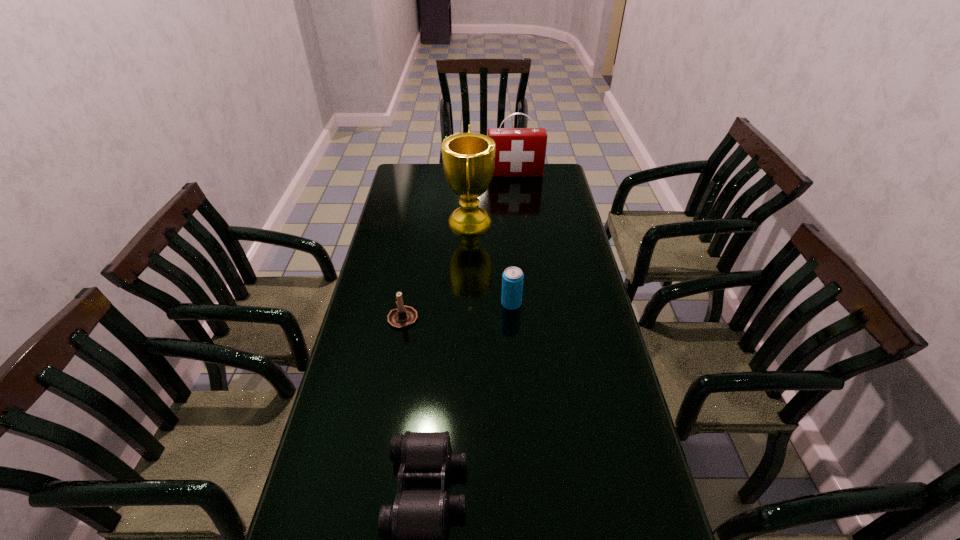
The height and width of the screenshot is (540, 960). What are the coordinates of `object located in the far edge section of the desktop` in the screenshot? It's located at (520, 152).

The width and height of the screenshot is (960, 540). What are the coordinates of `object located at the left edge` in the screenshot? It's located at (403, 316).

Locate an element on the screen. The image size is (960, 540). object that is at the right edge is located at coordinates (520, 152).

Locate an element on the screen. This screenshot has height=540, width=960. object located in the far right corner section of the desktop is located at coordinates (520, 152).

In the image, there is a desktop. Where is `free space at the left edge`? free space at the left edge is located at coordinates (392, 234).

The width and height of the screenshot is (960, 540). Identify the location of free location at the right edge. (555, 234).

Image resolution: width=960 pixels, height=540 pixels. In the image, there is a desktop. In order to click on free space at the far right corner in this screenshot , I will do `click(548, 181)`.

Image resolution: width=960 pixels, height=540 pixels. In order to click on free spot between the candle holder and the soda can in this screenshot , I will do `click(457, 310)`.

Locate an element on the screen. free point between the second shortest object and the farthest object is located at coordinates (459, 246).

The width and height of the screenshot is (960, 540). I want to click on vacant space in between the soda can and the fourth tallest object, so click(x=457, y=310).